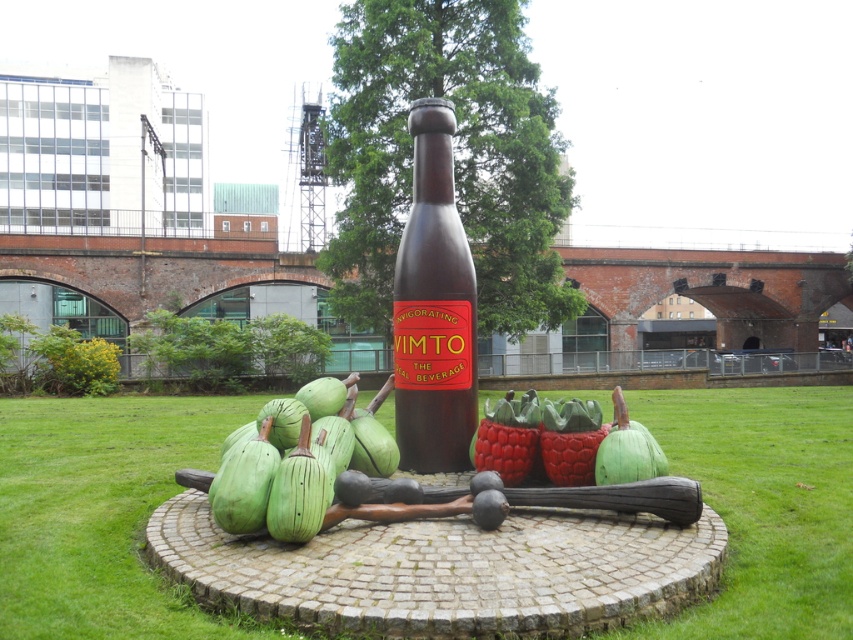
Question: Which of the following is the closest to the observer?

Choices:
 (A) coord(329,490)
 (B) coord(601,444)
 (C) coord(558,472)
 (D) coord(167,413)

Answer: (A)

Question: Among these points, which one is farthest from the camera?

Choices:
 (A) (260, 470)
 (B) (585, 436)

Answer: (B)

Question: Is green grass at center bigger than brown matte bottle at center?

Choices:
 (A) no
 (B) yes

Answer: (B)

Question: Observing the image, what is the correct spatial positioning of green matte squash at lower left in reference to rubberized green fruit at center?

Choices:
 (A) right
 (B) left

Answer: (B)

Question: Does brown matte bottle at center have a smaller size compared to green wood fruit at center?

Choices:
 (A) yes
 (B) no

Answer: (B)

Question: Which of the following is the farthest from the observer?

Choices:
 (A) brown matte bottle at center
 (B) green grass at center
 (C) green matte gourd at center
 (D) rubberized green fruit at center

Answer: (A)